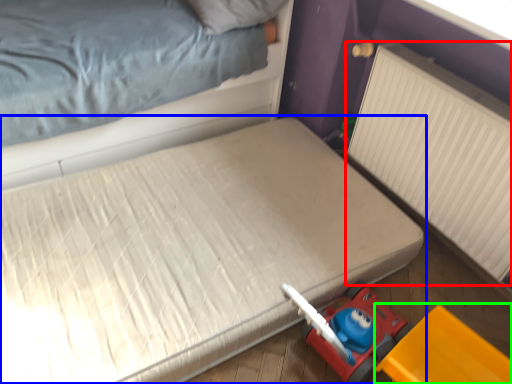
Question: Which object is positioned closest to radiator (highlighted by a red box)? Select from bed (highlighted by a blue box) and equipment (highlighted by a green box).

Choices:
 (A) bed
 (B) equipment

Answer: (B)